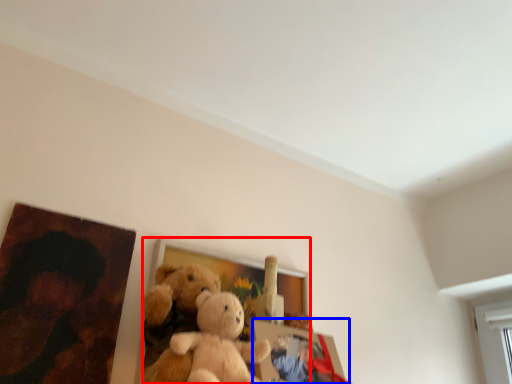
Question: Which point is further to the camera, picture frame (highlighted by a red box) or picture frame (highlighted by a blue box)?

Choices:
 (A) picture frame
 (B) picture frame

Answer: (A)